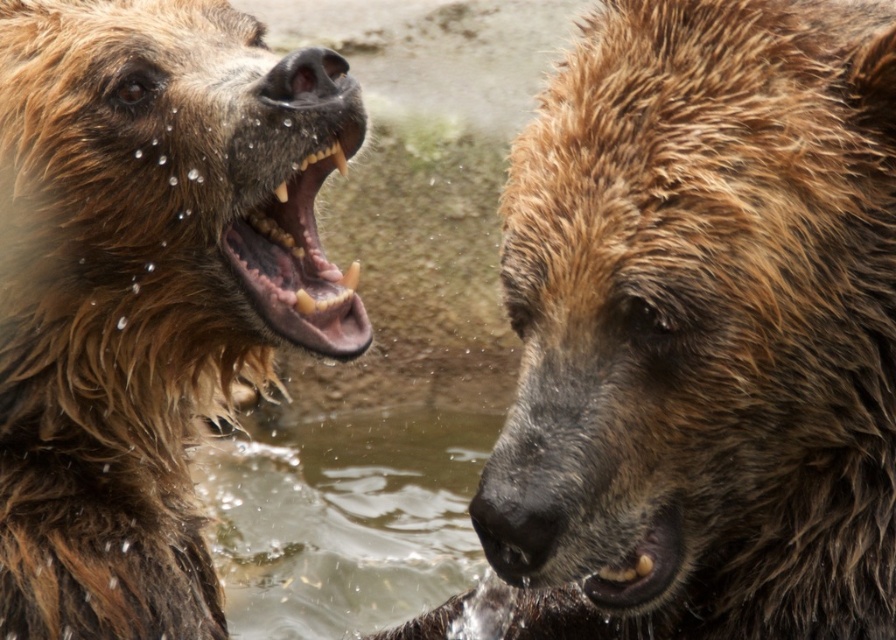
At what (x,y) coordinates should I click in order to perform the action: click on wet fur bear at left. Please return your answer as a coordinate pair (x, y). The height and width of the screenshot is (640, 896). Looking at the image, I should click on (147, 288).

Does wet fur bear at left appear on the left side of brown fur mouth at left?

Yes, wet fur bear at left is to the left of brown fur mouth at left.

Between point (156, 609) and point (315, 310), which one is positioned behind?

Positioned behind is point (315, 310).

I want to click on wet fur bear at left, so click(x=147, y=288).

Does wet fur bear at center appear over brown fur mouth at left?

Actually, wet fur bear at center is below brown fur mouth at left.

Between wet fur bear at center and brown fur mouth at left, which one is positioned lower?

wet fur bear at center

Who is more forward, (665, 465) or (336, 308)?

Positioned in front is point (665, 465).

Locate an element on the screen. The width and height of the screenshot is (896, 640). wet fur bear at center is located at coordinates (699, 333).

Identify the location of wet fur bear at center. Image resolution: width=896 pixels, height=640 pixels. (699, 333).

Is wet fur bear at center below wet fur bear at left?

Indeed, wet fur bear at center is positioned under wet fur bear at left.

Describe the element at coordinates (699, 333) in the screenshot. This screenshot has height=640, width=896. I see `wet fur bear at center` at that location.

Locate an element on the screen. Image resolution: width=896 pixels, height=640 pixels. wet fur bear at center is located at coordinates (699, 333).